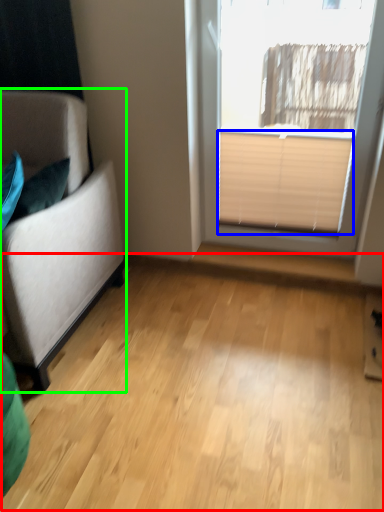
Question: Which is farther away from plain (highlighted by a red box)? blind (highlighted by a blue box) or studio couch (highlighted by a green box)?

Choices:
 (A) blind
 (B) studio couch

Answer: (A)